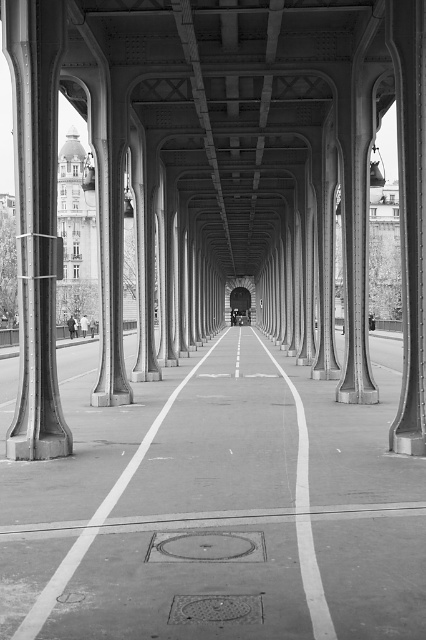
Looking at this image, you are standing on the Pont de Bir Hakeim bridge and want to take a photo of the point at coordinates (111, 508). If your camera has a focal length of 50mm and you are currently 10 meters away from the point, should you move closer or farther away to focus on the point?

The point at coordinates (111, 508) is 7.89 meters from the camera. Since you are currently 10 meters away, you need to move closer to reduce the distance to 7.89 meters for proper focus.